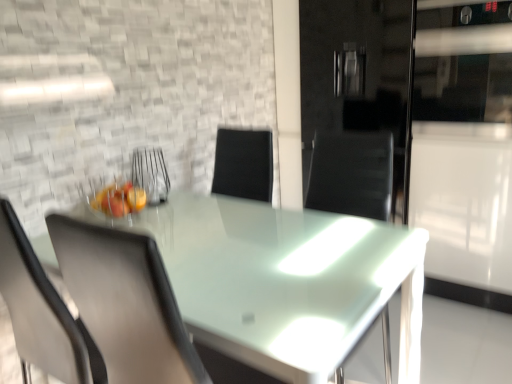
Question: Relative to metallic wire basket at center, is transparent glass table at center in front or behind?

Choices:
 (A) behind
 (B) front

Answer: (B)

Question: Is transparent glass table at center spatially inside metallic wire basket at center, or outside of it?

Choices:
 (A) inside
 (B) outside

Answer: (B)

Question: Estimate the real-world distances between objects in this image. Which object is closer to the transparent glass table at center?

Choices:
 (A) matte gray chair at left
 (B) metallic wire basket at center

Answer: (A)

Question: Based on their relative distances, which object is nearer to the matte gray chair at left?

Choices:
 (A) transparent glass table at center
 (B) metallic wire basket at center

Answer: (A)